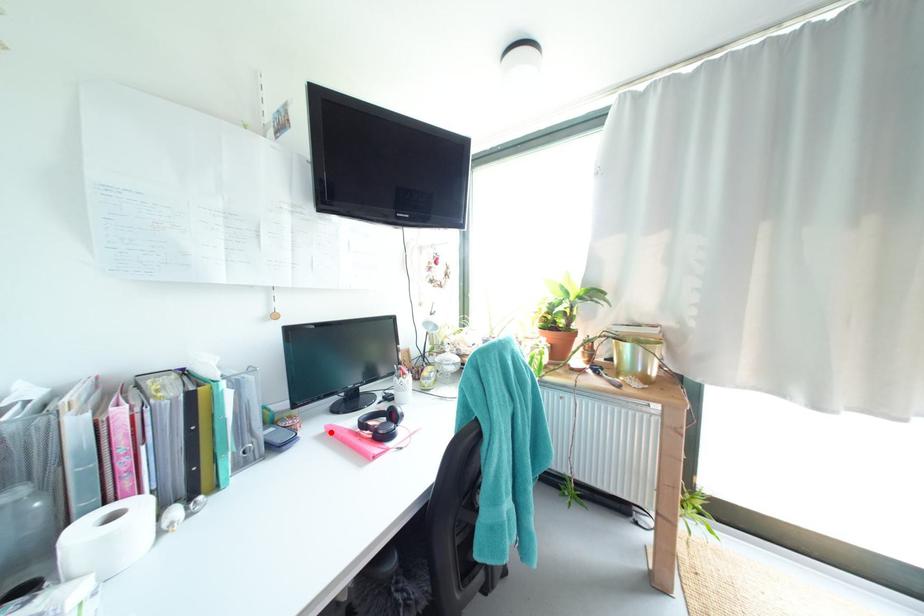
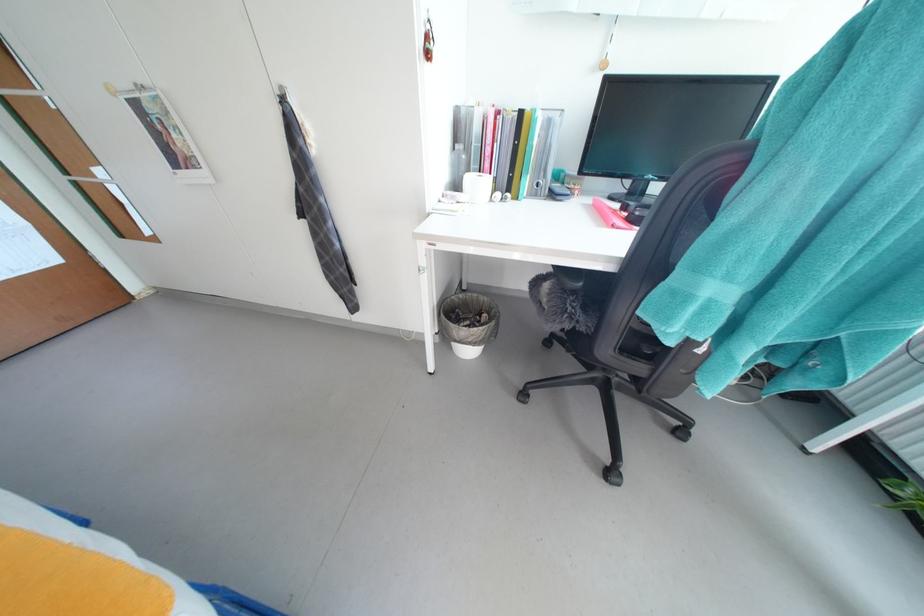
Find the pixel in the second image that matches the highlighted location in the first image.

(599, 204)